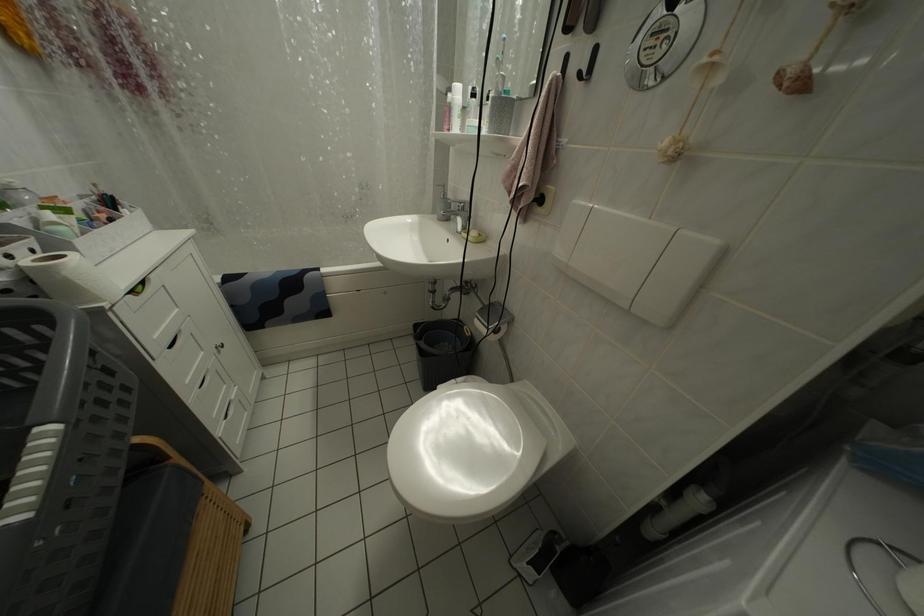
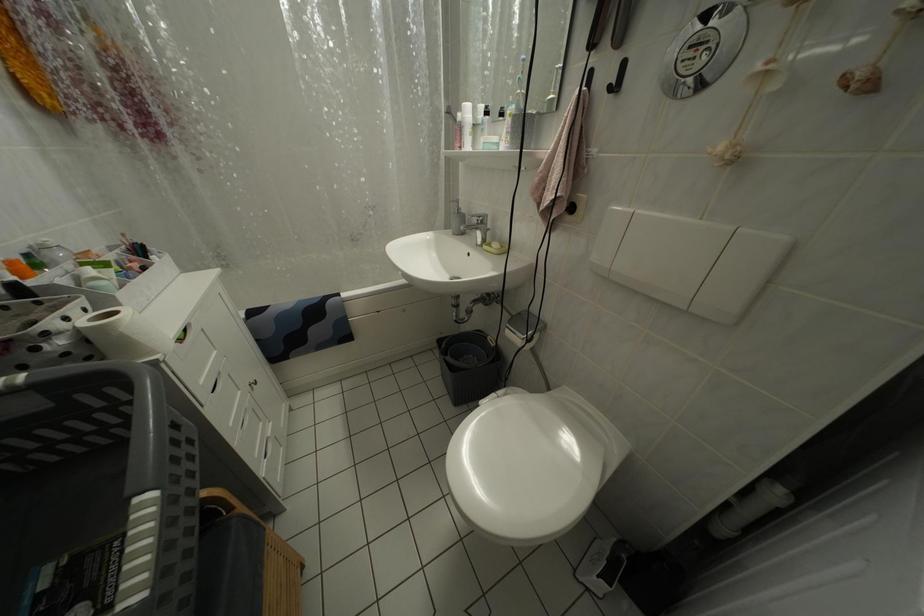
Question: What movement of the cameraman would produce the second image?

Choices:
 (A) Left
 (B) Right
 (C) Forward
 (D) Backward

Answer: (A)